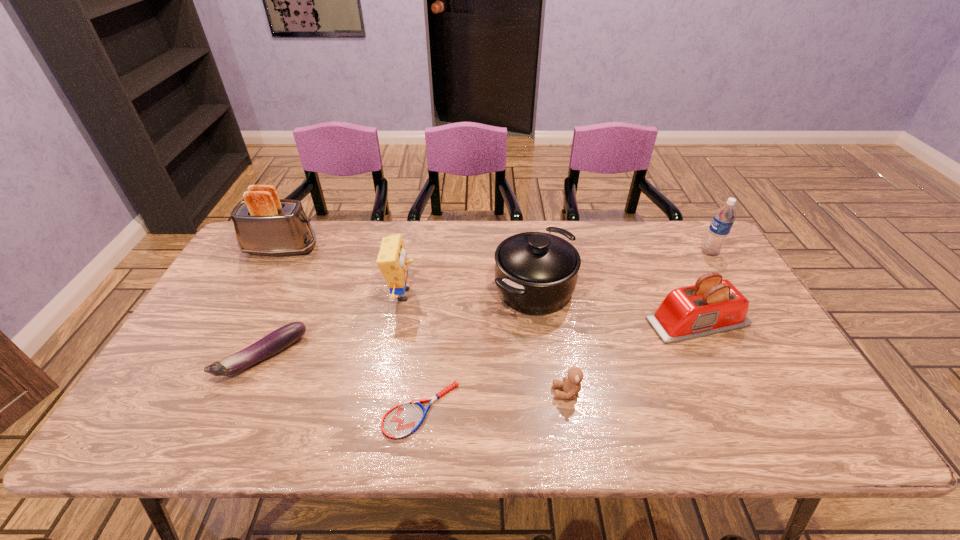
Find the location of a particular element. This screenshot has height=540, width=960. toaster situated at the far edge is located at coordinates (264, 224).

Identify the location of water bottle located at the far edge. (722, 222).

The image size is (960, 540). Identify the location of saucepan that is at the far edge. (536, 273).

This screenshot has height=540, width=960. I want to click on object present at the near edge, so click(x=402, y=420).

Where is `toaster located at the left edge`? This screenshot has width=960, height=540. toaster located at the left edge is located at coordinates tap(264, 224).

Find the location of a particular element. eggplant situated at the left edge is located at coordinates (271, 344).

Locate an element on the screen. This screenshot has width=960, height=540. water bottle that is at the right edge is located at coordinates [x=722, y=222].

The width and height of the screenshot is (960, 540). In order to click on toaster that is positioned at the right edge in this screenshot , I will do `click(712, 305)`.

Identify the location of object at the far left corner. (264, 224).

Identify the location of object located at the far right corner. This screenshot has width=960, height=540. (722, 222).